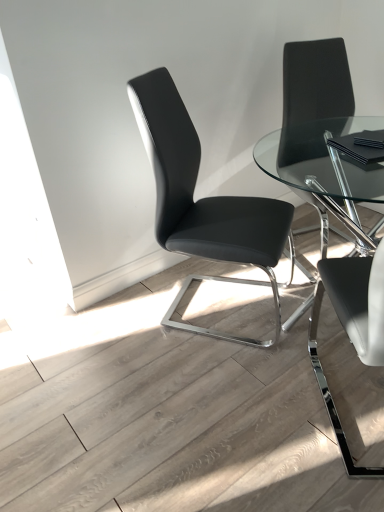
The height and width of the screenshot is (512, 384). I want to click on black leather chair at upper right, which appears as the first chair when viewed from the right, so click(x=316, y=82).

Between point (137, 120) and point (343, 106), which one is positioned in front?

The point (137, 120) is in front.

In the scene shown: Are black leather chair at center, which ranks as the 1th chair in left-to-right order, and black leather chair at upper right, which appears as the first chair when viewed from the right, far apart?

black leather chair at center, which ranks as the 1th chair in left-to-right order, is actually quite close to black leather chair at upper right, which appears as the first chair when viewed from the right.

Is black leather chair at center, the 3th chair from the right, turned away from black leather chair at upper right, which appears as the first chair when viewed from the right?

black leather chair at center, the 3th chair from the right, is not turned away from black leather chair at upper right, which appears as the first chair when viewed from the right.

Considering the relative sizes of black leather chair at center, which ranks as the 1th chair in left-to-right order, and black leather chair at upper right, marked as the 3th chair in a left-to-right arrangement, in the image provided, is black leather chair at center, which ranks as the 1th chair in left-to-right order, bigger than black leather chair at upper right, marked as the 3th chair in a left-to-right arrangement,?

Yes.

Can you tell me how much black leather chair at center, which ranks as the 1th chair in left-to-right order, and black leather chair at right, the second chair in the left-to-right sequence, differ in facing direction?

black leather chair at center, which ranks as the 1th chair in left-to-right order, and black leather chair at right, the second chair in the left-to-right sequence, are facing 106 degrees away from each other.

Measure the distance from black leather chair at center, which ranks as the 1th chair in left-to-right order, to black leather chair at right, which is counted as the second chair, starting from the right.

They are 20.33 inches apart.

From a real-world perspective, is black leather chair at center, the 3th chair from the right, positioned above or below black leather chair at right, which is counted as the second chair, starting from the right?

black leather chair at center, the 3th chair from the right, is situated lower than black leather chair at right, which is counted as the second chair, starting from the right, in the real world.

Is black leather chair at center, the 3th chair from the right, positioned beyond the bounds of black leather chair at right, the second chair in the left-to-right sequence?

Yes.

From a real-world perspective, starting from the black leather chair at upper right, which appears as the first chair when viewed from the right, which chair is the 2nd one below it? Please provide its 2D coordinates.

[(203, 200)]

Considering the positions of objects black leather chair at upper right, which appears as the first chair when viewed from the right, and black leather chair at center, the 3th chair from the right, in the image provided, who is behind, black leather chair at upper right, which appears as the first chair when viewed from the right, or black leather chair at center, the 3th chair from the right,?

Positioned behind is black leather chair at upper right, which appears as the first chair when viewed from the right.

Based on the photo, between black leather chair at upper right, which appears as the first chair when viewed from the right, and black leather chair at center, which ranks as the 1th chair in left-to-right order, which one has less height?

With less height is black leather chair at upper right, which appears as the first chair when viewed from the right.

Is black leather chair at upper right, which appears as the first chair when viewed from the right, facing towards black leather chair at right, the second chair in the left-to-right sequence?

No, black leather chair at upper right, which appears as the first chair when viewed from the right, is not facing towards black leather chair at right, the second chair in the left-to-right sequence.

Can you confirm if black leather chair at upper right, which appears as the first chair when viewed from the right, is smaller than black leather chair at right, the second chair in the left-to-right sequence?

No.

Is black leather chair at right, the second chair in the left-to-right sequence, located within black leather chair at upper right, marked as the 3th chair in a left-to-right arrangement?

No, black leather chair at right, the second chair in the left-to-right sequence, is located outside of black leather chair at upper right, marked as the 3th chair in a left-to-right arrangement.

Where is `chair located above the black leather chair at right, which is counted as the second chair, starting from the right (from a real-world perspective)`? This screenshot has width=384, height=512. chair located above the black leather chair at right, which is counted as the second chair, starting from the right (from a real-world perspective) is located at coordinates (316, 82).

Which object is further away from the camera taking this photo, black leather chair at right, which is counted as the second chair, starting from the right, or black leather chair at upper right, marked as the 3th chair in a left-to-right arrangement?

black leather chair at upper right, marked as the 3th chair in a left-to-right arrangement, is further from the camera.

Between point (321, 296) and point (338, 45), which one is positioned in front?

Positioned in front is point (321, 296).

Does black leather chair at right, the second chair in the left-to-right sequence, have a lesser height compared to black leather chair at upper right, marked as the 3th chair in a left-to-right arrangement?

Correct, black leather chair at right, the second chair in the left-to-right sequence, is not as tall as black leather chair at upper right, marked as the 3th chair in a left-to-right arrangement.

Between black leather chair at right, which is counted as the second chair, starting from the right, and black leather chair at center, which ranks as the 1th chair in left-to-right order, which one appears on the left side from the viewer's perspective?

Positioned to the left is black leather chair at center, which ranks as the 1th chair in left-to-right order.

Can you confirm if black leather chair at right, which is counted as the second chair, starting from the right, is smaller than black leather chair at center, the 3th chair from the right?

Yes.

Is black leather chair at center, which ranks as the 1th chair in left-to-right order, at the back of black leather chair at right, the second chair in the left-to-right sequence?

No, black leather chair at right, the second chair in the left-to-right sequence,'s orientation is not away from black leather chair at center, which ranks as the 1th chair in left-to-right order.

Locate an element on the screen. Image resolution: width=384 pixels, height=512 pixels. the 2nd chair to the left of the black leather chair at upper right, which appears as the first chair when viewed from the right, counting from the anchor's position is located at coordinates (203, 200).

Image resolution: width=384 pixels, height=512 pixels. I want to click on chair in front of the black leather chair at center, which ranks as the 1th chair in left-to-right order, so click(x=359, y=301).

Which object lies nearer to the anchor point black leather chair at upper right, which appears as the first chair when viewed from the right, black leather chair at center, which ranks as the 1th chair in left-to-right order, or black leather chair at right, the second chair in the left-to-right sequence?

black leather chair at center, which ranks as the 1th chair in left-to-right order.

Based on their spatial positions, is black leather chair at upper right, marked as the 3th chair in a left-to-right arrangement, or black leather chair at right, which is counted as the second chair, starting from the right, closer to black leather chair at center, which ranks as the 1th chair in left-to-right order?

Among the two, black leather chair at right, which is counted as the second chair, starting from the right, is located nearer to black leather chair at center, which ranks as the 1th chair in left-to-right order.

Considering their positions, is black leather chair at right, which is counted as the second chair, starting from the right, positioned closer to black leather chair at center, the 3th chair from the right, than black leather chair at upper right, marked as the 3th chair in a left-to-right arrangement?

black leather chair at right, which is counted as the second chair, starting from the right, is positioned closer to the anchor black leather chair at center, the 3th chair from the right.

Based on their spatial positions, is black leather chair at center, which ranks as the 1th chair in left-to-right order, or black leather chair at upper right, which appears as the first chair when viewed from the right, closer to black leather chair at right, which is counted as the second chair, starting from the right?

black leather chair at center, which ranks as the 1th chair in left-to-right order, is closer to black leather chair at right, which is counted as the second chair, starting from the right.

Estimate the real-world distances between objects in this image. Which object is further from black leather chair at right, the second chair in the left-to-right sequence, black leather chair at upper right, marked as the 3th chair in a left-to-right arrangement, or black leather chair at center, which ranks as the 1th chair in left-to-right order?

black leather chair at upper right, marked as the 3th chair in a left-to-right arrangement, lies further to black leather chair at right, the second chair in the left-to-right sequence, than the other object.

From the image, which object appears to be nearer to black leather chair at upper right, which appears as the first chair when viewed from the right, black leather chair at right, which is counted as the second chair, starting from the right, or black leather chair at center, the 3th chair from the right?

black leather chair at center, the 3th chair from the right, is closer to black leather chair at upper right, which appears as the first chair when viewed from the right.

This screenshot has width=384, height=512. Find the location of `chair between black leather chair at right, which is counted as the second chair, starting from the right, and black leather chair at upper right, marked as the 3th chair in a left-to-right arrangement, along the z-axis`. chair between black leather chair at right, which is counted as the second chair, starting from the right, and black leather chair at upper right, marked as the 3th chair in a left-to-right arrangement, along the z-axis is located at coordinates (203, 200).